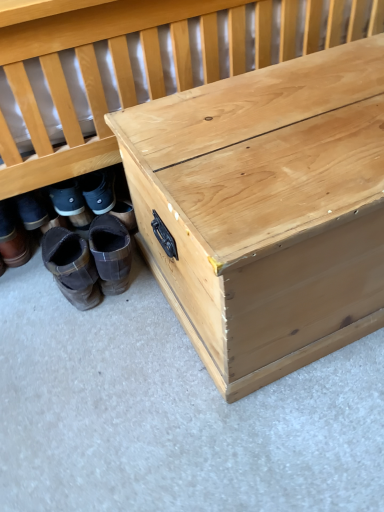
Question: Is brown suede boots at lower left, positioned as the third footwear in right-to-left order, smaller than brown suede boots at lower left, which ranks as the first footwear in right-to-left order?

Choices:
 (A) no
 (B) yes

Answer: (A)

Question: From a real-world perspective, is brown suede boots at lower left, the first footwear from the left, physically above brown suede boots at lower left, which ranks as the first footwear in right-to-left order?

Choices:
 (A) no
 (B) yes

Answer: (B)

Question: Can we say brown suede boots at lower left, positioned as the third footwear in right-to-left order, lies outside brown suede boots at lower left, the 3th footwear in the left-to-right sequence?

Choices:
 (A) yes
 (B) no

Answer: (A)

Question: Is brown suede boots at lower left, the first footwear from the left, to the right of brown suede boots at lower left, which ranks as the first footwear in right-to-left order, from the viewer's perspective?

Choices:
 (A) yes
 (B) no

Answer: (B)

Question: Would you say brown suede boots at lower left, positioned as the third footwear in right-to-left order, contains brown suede boots at lower left, the 3th footwear in the left-to-right sequence?

Choices:
 (A) yes
 (B) no

Answer: (B)

Question: From the image's perspective, is natural wood trunk at lower right positioned above or below brown suede boots at lower left, positioned as the third footwear in right-to-left order?

Choices:
 (A) above
 (B) below

Answer: (A)

Question: Considering the relative positions of natural wood trunk at lower right and brown suede boots at lower left, positioned as the third footwear in right-to-left order, in the image provided, is natural wood trunk at lower right to the left or to the right of brown suede boots at lower left, positioned as the third footwear in right-to-left order,?

Choices:
 (A) left
 (B) right

Answer: (B)

Question: From a real-world perspective, is natural wood trunk at lower right above or below brown suede boots at lower left, the first footwear from the left?

Choices:
 (A) above
 (B) below

Answer: (A)

Question: Which is correct: natural wood trunk at lower right is inside brown suede boots at lower left, positioned as the third footwear in right-to-left order, or outside of it?

Choices:
 (A) outside
 (B) inside

Answer: (A)

Question: Which is correct: natural wood trunk at lower right is inside natural wood trunk at center, or outside of it?

Choices:
 (A) inside
 (B) outside

Answer: (B)

Question: From the image's perspective, relative to natural wood trunk at center, is natural wood trunk at lower right above or below?

Choices:
 (A) below
 (B) above

Answer: (B)

Question: Visually, is natural wood trunk at lower right positioned to the left or to the right of natural wood trunk at center?

Choices:
 (A) left
 (B) right

Answer: (A)

Question: Is point (13, 174) positioned closer to the camera than point (339, 146)?

Choices:
 (A) farther
 (B) closer

Answer: (A)

Question: Do you think natural wood trunk at center is within natural wood trunk at lower right, or outside of it?

Choices:
 (A) inside
 (B) outside

Answer: (B)

Question: Is natural wood trunk at center wider or thinner than natural wood trunk at lower right?

Choices:
 (A) thin
 (B) wide

Answer: (A)